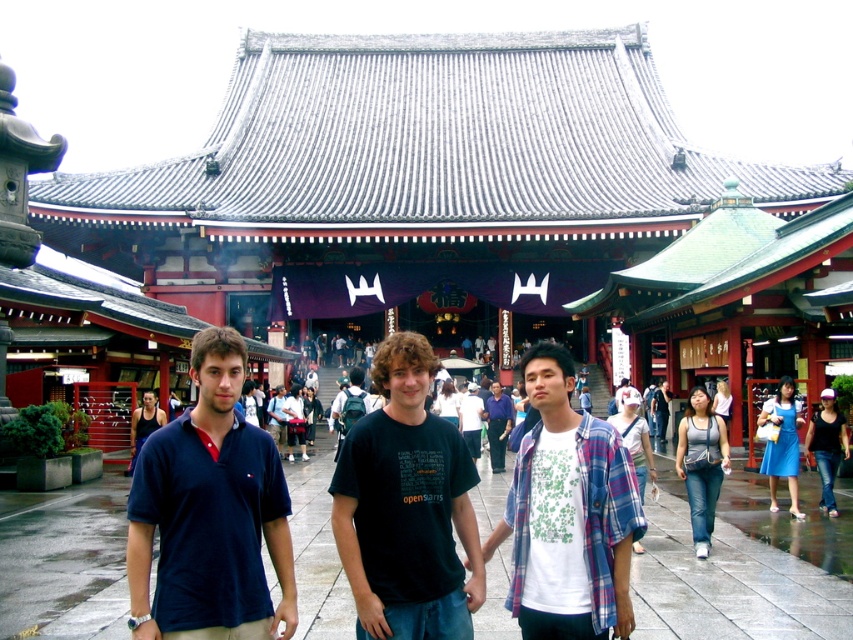
Can you confirm if white cotton shirt at center is shorter than dark blue shirt at center?

Incorrect, white cotton shirt at center's height does not fall short of dark blue shirt at center's.

Who is positioned more to the left, white cotton shirt at center or dark blue shirt at center?

white cotton shirt at center

Is point (595, 470) positioned behind point (490, 412)?

That is False.

Image resolution: width=853 pixels, height=640 pixels. Identify the location of white cotton shirt at center. (567, 515).

Which is below, dark blue polo shirt at left or white cotton shirt at center?

dark blue polo shirt at left

The height and width of the screenshot is (640, 853). What do you see at coordinates (210, 513) in the screenshot?
I see `dark blue polo shirt at left` at bounding box center [210, 513].

Find the location of a particular element. This screenshot has height=640, width=853. dark blue polo shirt at left is located at coordinates (210, 513).

In the scene shown: Can you confirm if gray concrete pavement at center is wider than dark blue polo shirt at left?

Yes, gray concrete pavement at center is wider than dark blue polo shirt at left.

Is point (735, 616) positioned before point (252, 506)?

That is False.

Find the location of a particular element. gray concrete pavement at center is located at coordinates (730, 586).